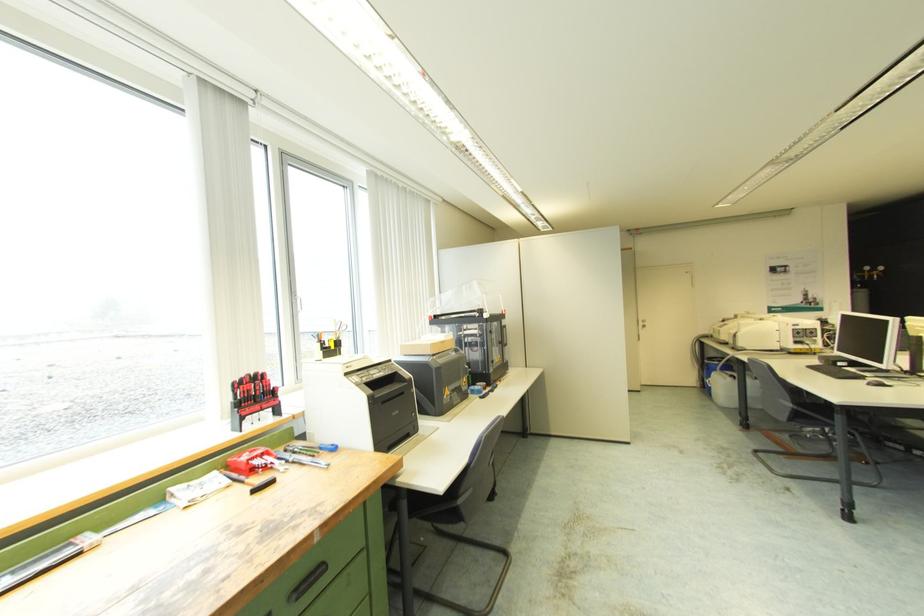
At what (x,y) coordinates should I click in order to perform the action: click on blue handle screwdriver. Please return your answer as a coordinate pair (x, y). Looking at the image, I should click on (312, 446).